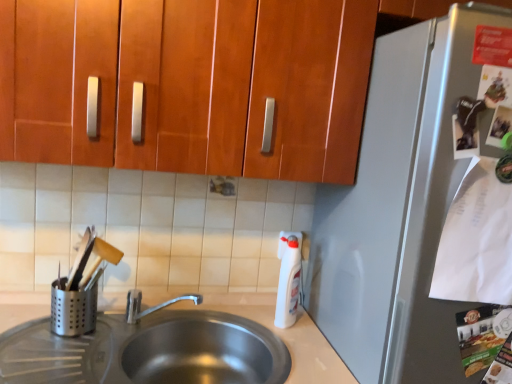
Question: Based on their sizes in the image, would you say white plastic bottle at right is bigger or smaller than silver metallic utensil holder at left?

Choices:
 (A) big
 (B) small

Answer: (A)

Question: From the image's perspective, is white plastic bottle at right positioned above or below silver metallic utensil holder at left?

Choices:
 (A) below
 (B) above

Answer: (B)

Question: Which of these objects is positioned closest to the satin silver refrigerator at right?

Choices:
 (A) wooden cabinet at upper center
 (B) white plastic bottle at right
 (C) satin silver sink at lower left
 (D) silver metallic utensil holder at left

Answer: (A)

Question: Which object is positioned farthest from the silver metallic utensil holder at left?

Choices:
 (A) satin silver sink at lower left
 (B) wooden cabinet at upper center
 (C) satin silver refrigerator at right
 (D) white plastic bottle at right

Answer: (C)